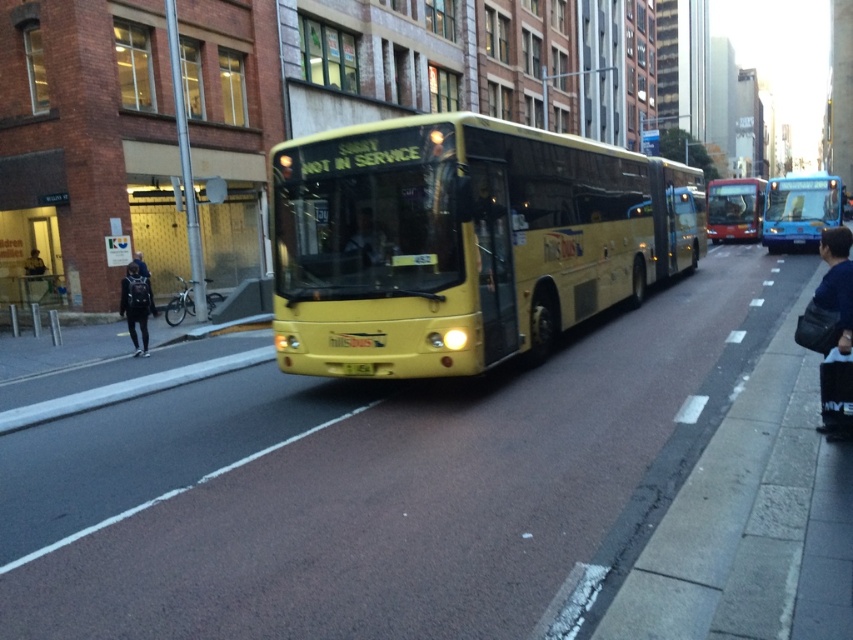
Question: Which of the following is the farthest from the observer?

Choices:
 (A) denim jacket at lower right
 (B) yellow matte bus at center
 (C) metallic red bus at center

Answer: (C)

Question: Among these objects, which one is farthest from the camera?

Choices:
 (A) matte black bus at center
 (B) yellow matte bus at center
 (C) denim jacket at lower right

Answer: (A)

Question: Can you confirm if yellow matte bus at center is thinner than metallic red bus at center?

Choices:
 (A) yes
 (B) no

Answer: (B)

Question: Is metallic red bus at center below dark blue fabric jacket at left?

Choices:
 (A) yes
 (B) no

Answer: (B)

Question: Is yellow matte bus at center closer to camera compared to blue glossy bus at center?

Choices:
 (A) no
 (B) yes

Answer: (B)

Question: Which point is farther to the camera?

Choices:
 (A) dark blue fabric jacket at left
 (B) matte black bus at center
 (C) yellow matte bus at center
 (D) denim jacket at lower right

Answer: (A)